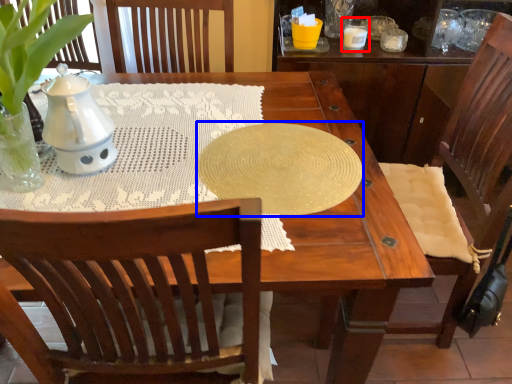
Question: Which of the following is the closest to the observer, candle holder (highlighted by a red box) or oval (highlighted by a blue box)?

Choices:
 (A) candle holder
 (B) oval

Answer: (B)